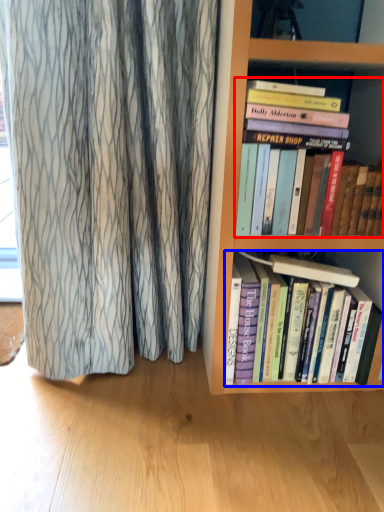
Question: Which point is further to the camera, book (highlighted by a red box) or book (highlighted by a blue box)?

Choices:
 (A) book
 (B) book

Answer: (B)